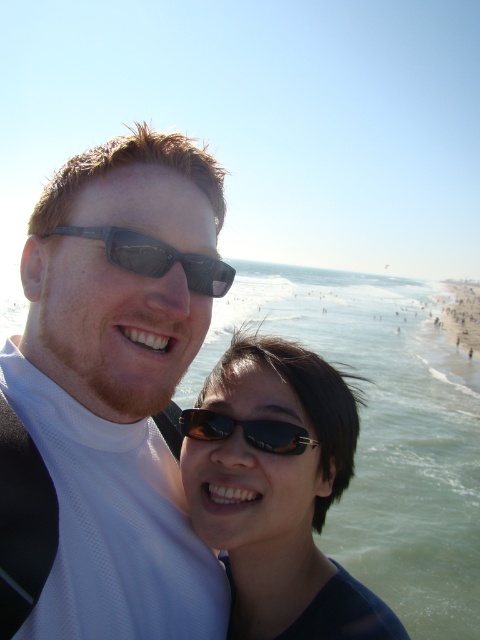
Between matte black sunglasses at upper left and sunglasses at center, which one is positioned lower?

sunglasses at center is lower down.

Does matte black sunglasses at upper left appear under sunglasses at center?

No.

Does point (216, 259) lie behind point (215, 424)?

No, (216, 259) is in front of (215, 424).

Image resolution: width=480 pixels, height=640 pixels. What are the coordinates of `matte black sunglasses at upper left` in the screenshot? It's located at (118, 385).

Between matte black sunglasses at upper left and black matte sunglasses at upper center, which one appears on the left side from the viewer's perspective?

matte black sunglasses at upper left is more to the left.

Which is in front, point (126, 300) or point (129, 260)?

Point (129, 260) is more forward.

The width and height of the screenshot is (480, 640). Identify the location of matte black sunglasses at upper left. (118, 385).

The width and height of the screenshot is (480, 640). What do you see at coordinates (118, 385) in the screenshot? I see `matte black sunglasses at upper left` at bounding box center [118, 385].

You are a GUI agent. You are given a task and a screenshot of the screen. Output one action in this format:
    pyautogui.click(x=<x>, y=<y>)
    Task: Click on the matte black sunglasses at upper left
    This screenshot has width=480, height=640.
    Given the screenshot: What is the action you would take?
    pyautogui.click(x=118, y=385)